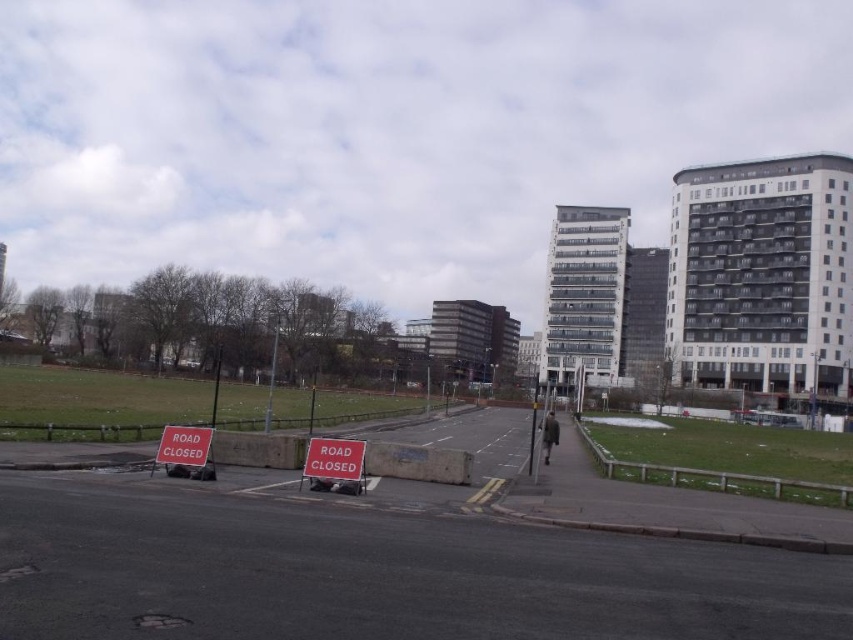
You are a delivery driver who needs to find the nearest open road. You see a point at coordinate (334, 458) in the image. What object is located at this point?

The point at coordinate (334, 458) indicates a red plastic sign at center.

You are standing at the closed road and looking towards the buildings. There are two points marked on the road surface, one at coordinates point (355, 454) and the other at point (155, 452). Which point is closer to you?

Point (355, 454) is closer to the camera than point (155, 452), so the point at coordinates point (355, 454) is closer to you.